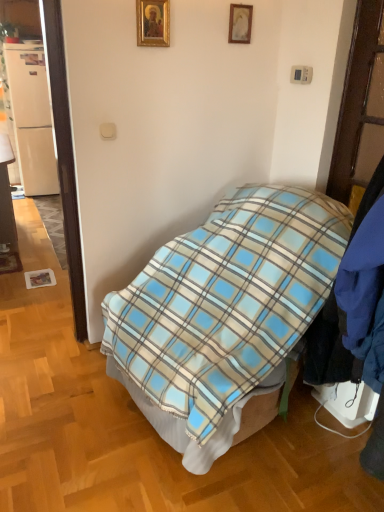
Question: In terms of size, does white glossy door at left appear bigger or smaller than gold-framed picture at upper center, the 2th picture frame in the right-to-left sequence?

Choices:
 (A) big
 (B) small

Answer: (A)

Question: From a real-world perspective, is white glossy door at left physically located above or below gold-framed picture at upper center, the 2th picture frame in the right-to-left sequence?

Choices:
 (A) above
 (B) below

Answer: (B)

Question: Which of these objects is positioned farthest from the matte wood desk at left?

Choices:
 (A) wooden picture frame at upper center, marked as the 2th picture frame in a front-to-back arrangement
 (B) gold-framed picture at upper center, the 2th picture frame in the right-to-left sequence
 (C) blue plaid blanket at center
 (D) white matte refrigerator at left
 (E) white glossy door at left

Answer: (A)

Question: Which object is the farthest from the gold-framed picture at upper center, the 2th picture frame in the right-to-left sequence?

Choices:
 (A) white matte refrigerator at left
 (B) wooden picture frame at upper center, the 2th picture frame positioned from the left
 (C) matte wood desk at left
 (D) blue plaid blanket at center
 (E) white glossy door at left

Answer: (A)